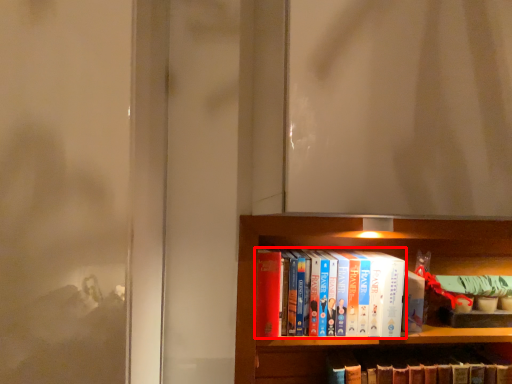
Question: Considering the relative positions of book (annotated by the red box) and book in the image provided, where is book (annotated by the red box) located with respect to the staircase?

Choices:
 (A) right
 (B) left

Answer: (B)